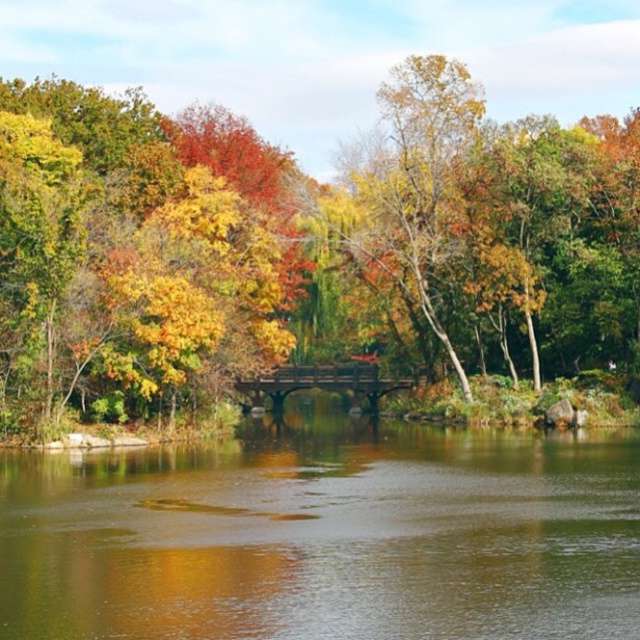
Question: Is yellow matte tree at center wider than green reflective water at center?

Choices:
 (A) no
 (B) yes

Answer: (B)

Question: Does yellow matte tree at center lie behind green reflective water at center?

Choices:
 (A) no
 (B) yes

Answer: (B)

Question: Which object is closer to the camera taking this photo?

Choices:
 (A) green reflective water at center
 (B) yellow matte tree at center

Answer: (A)

Question: Can you confirm if yellow matte tree at center is thinner than green reflective water at center?

Choices:
 (A) no
 (B) yes

Answer: (A)